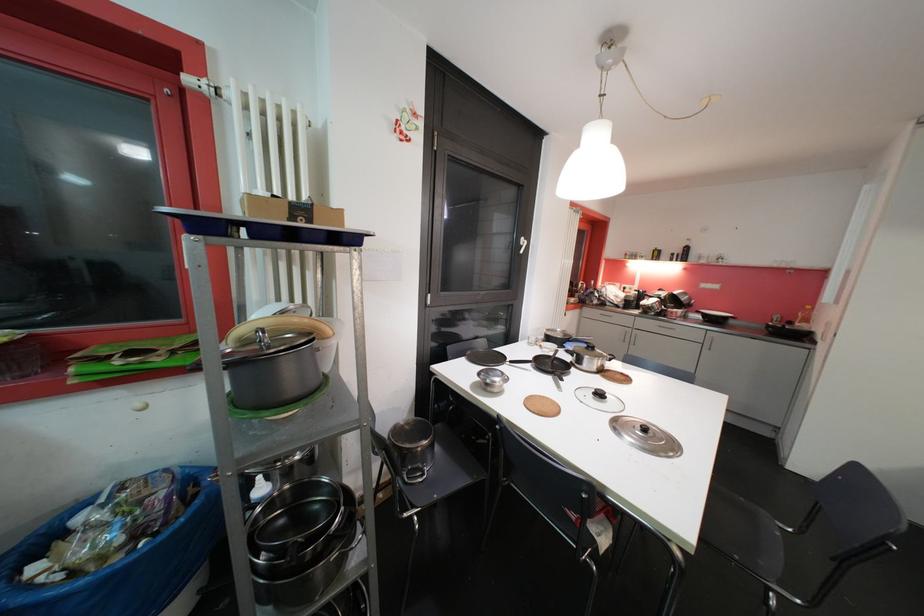
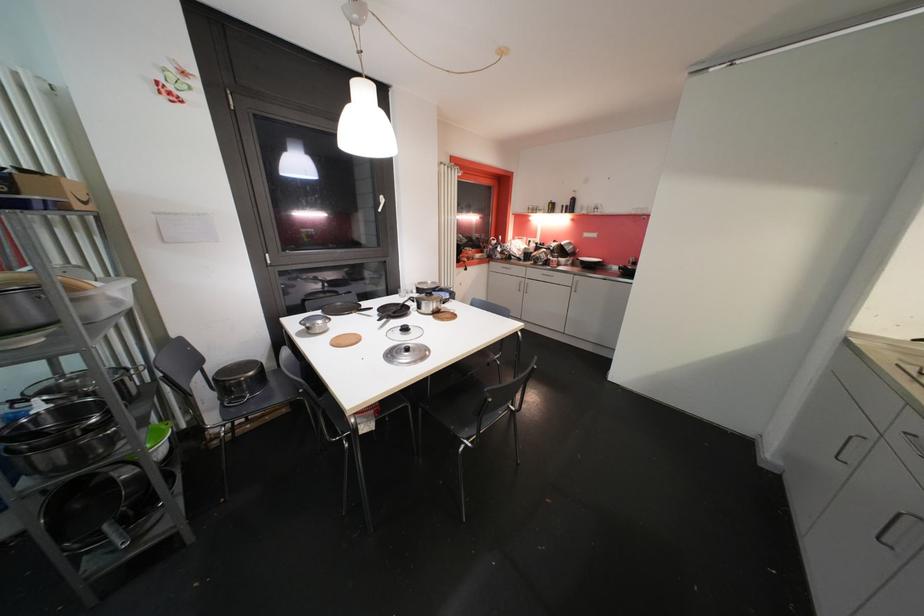
Question: In a continuous first-person perspective shot, in which direction is the camera moving?

Choices:
 (A) Left
 (B) Right
 (C) Forward
 (D) Backward

Answer: (B)